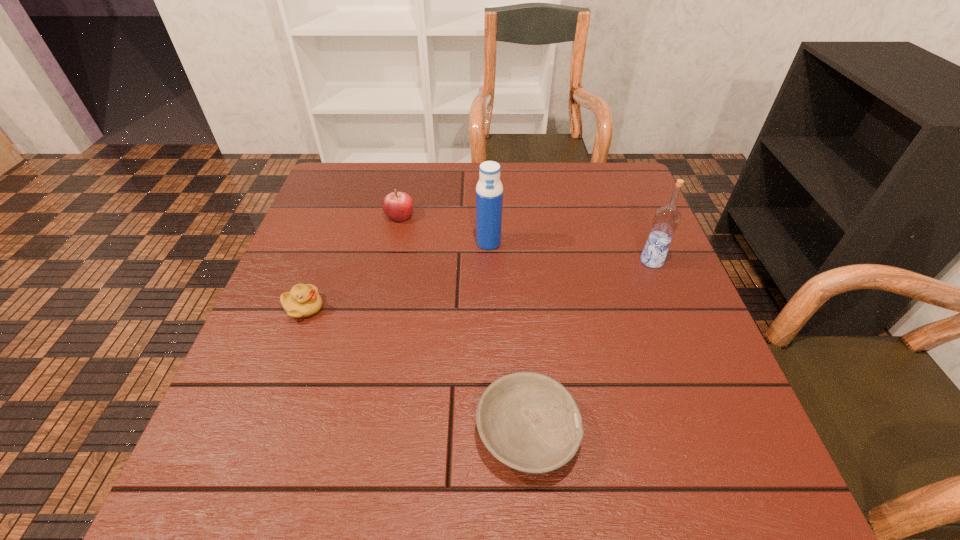
Where is `vacant point that satisfies the following two spatial constraints: 1. on the back side of the shortest object; 2. on the left side of the rightmost object`? This screenshot has width=960, height=540. vacant point that satisfies the following two spatial constraints: 1. on the back side of the shortest object; 2. on the left side of the rightmost object is located at coordinates (514, 261).